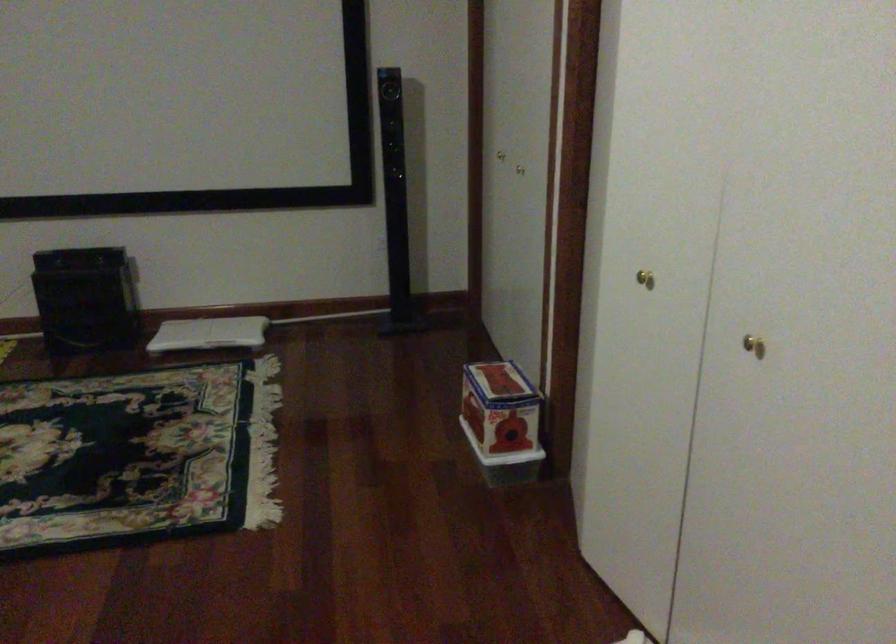
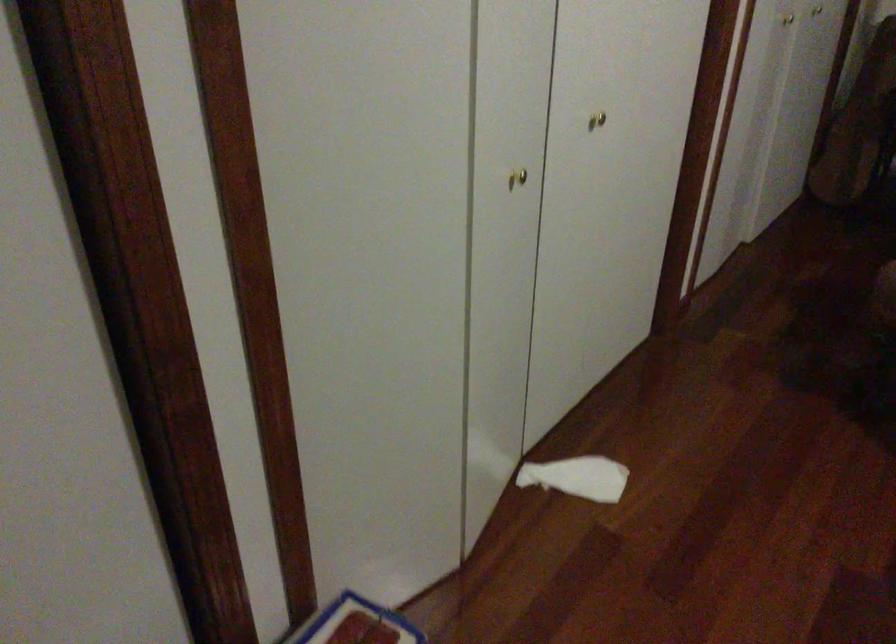
Locate, in the second image, the point that corresponds to point 659,295 in the first image.

(517, 178)